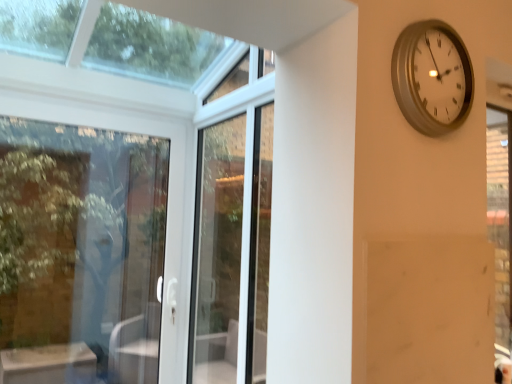
Question: Considering the relative sizes of clear glass door at left and white glass screen door at center in the image provided, is clear glass door at left taller than white glass screen door at center?

Choices:
 (A) yes
 (B) no

Answer: (B)

Question: Is clear glass door at left facing towards white glass screen door at center?

Choices:
 (A) no
 (B) yes

Answer: (B)

Question: Is clear glass door at left next to white glass screen door at center?

Choices:
 (A) yes
 (B) no

Answer: (B)

Question: From a real-world perspective, is clear glass door at left physically below white glass screen door at center?

Choices:
 (A) yes
 (B) no

Answer: (A)

Question: Is the position of clear glass door at left less distant than that of white glass screen door at center?

Choices:
 (A) yes
 (B) no

Answer: (B)

Question: In terms of height, does clear glass door at left look taller or shorter compared to white glass screen door at center?

Choices:
 (A) tall
 (B) short

Answer: (B)

Question: Does point pyautogui.click(x=138, y=339) appear closer or farther from the camera than point pyautogui.click(x=241, y=261)?

Choices:
 (A) closer
 (B) farther

Answer: (B)

Question: From the image's perspective, relative to white glass screen door at center, is clear glass door at left above or below?

Choices:
 (A) below
 (B) above

Answer: (A)

Question: Would you say clear glass door at left is inside or outside white glass screen door at center?

Choices:
 (A) outside
 (B) inside

Answer: (A)

Question: From their relative heights in the image, would you say silver metallic clock at upper right is taller or shorter than white glass screen door at center?

Choices:
 (A) tall
 (B) short

Answer: (B)

Question: Looking at the image, does silver metallic clock at upper right seem bigger or smaller compared to white glass screen door at center?

Choices:
 (A) big
 (B) small

Answer: (B)

Question: Considering their positions, is silver metallic clock at upper right located in front of or behind white glass screen door at center?

Choices:
 (A) front
 (B) behind

Answer: (A)

Question: From the image's perspective, is silver metallic clock at upper right above or below white glass screen door at center?

Choices:
 (A) above
 (B) below

Answer: (A)

Question: From a real-world perspective, is silver metallic clock at upper right positioned above or below clear glass door at left?

Choices:
 (A) below
 (B) above

Answer: (B)

Question: In the image, is silver metallic clock at upper right positioned in front of or behind clear glass door at left?

Choices:
 (A) behind
 (B) front

Answer: (B)